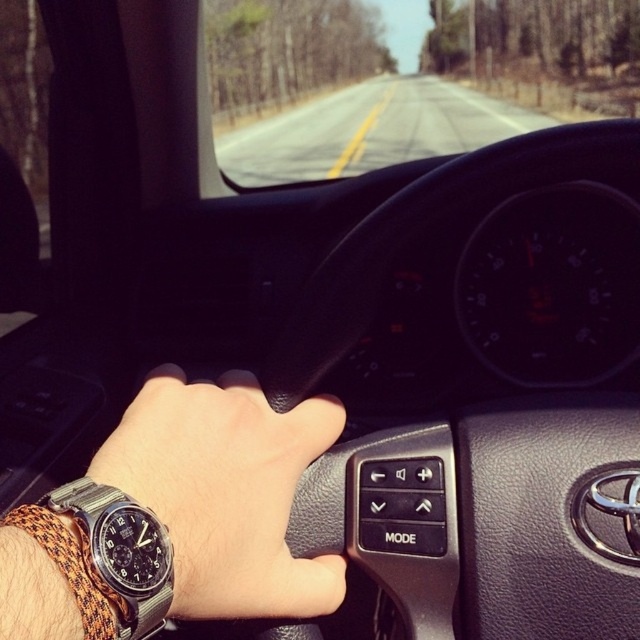
Is point (282, 468) less distant than point (115, 518)?

No, it is not.

Which is behind, point (218, 545) or point (83, 532)?

The point (218, 545) is more distant.

Is point (256, 577) positioned after point (168, 538)?

Yes, it is behind point (168, 538).

At what (x,y) coordinates should I click in order to perform the action: click on leather watch at center. Please return your answer as a coordinate pair (x, y). Image resolution: width=640 pixels, height=640 pixels. Looking at the image, I should click on (225, 492).

Does leather watch at center have a greater width compared to black leather steering wheel at center?

No.

Measure the distance from leather watch at center to black leather steering wheel at center.

leather watch at center is 6.75 inches from black leather steering wheel at center.

Between point (305, 586) and point (378, 237), which one is positioned in front?

Point (305, 586) is in front.

Where is `leather watch at center`? This screenshot has width=640, height=640. leather watch at center is located at coordinates (225, 492).

Can you confirm if black leather steering wheel at center is thinner than silver metallic watch at lower left?

No.

Who is lower down, black leather steering wheel at center or silver metallic watch at lower left?

Positioned lower is silver metallic watch at lower left.

What do you see at coordinates (400, 244) in the screenshot? Image resolution: width=640 pixels, height=640 pixels. I see `black leather steering wheel at center` at bounding box center [400, 244].

The image size is (640, 640). Identify the location of black leather steering wheel at center. (400, 244).